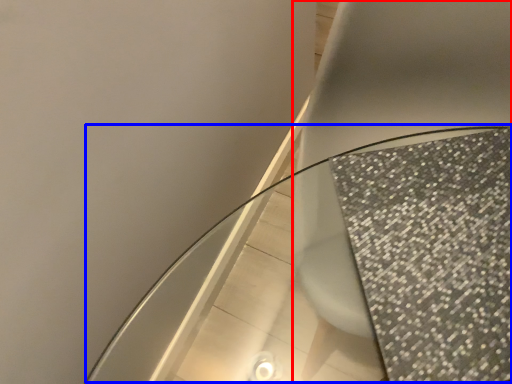
Question: Which object is further to the camera taking this photo, toilet (highlighted by a red box) or round table (highlighted by a blue box)?

Choices:
 (A) toilet
 (B) round table

Answer: (A)